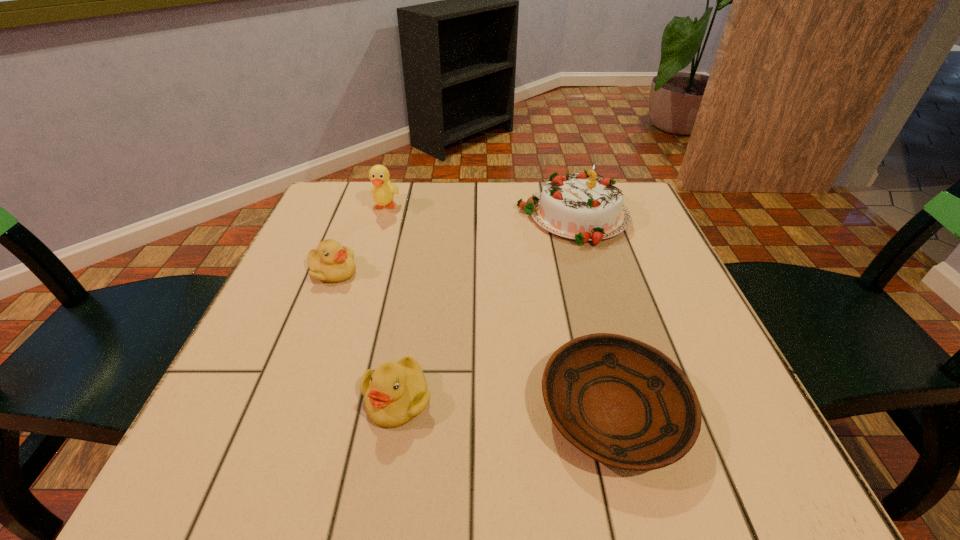
In order to click on cake in this screenshot , I will do [x=582, y=206].

Locate an element on the screen. the tallest duckling is located at coordinates (383, 191).

The image size is (960, 540). What are the coordinates of `the rightmost duckling` in the screenshot? It's located at (396, 392).

Find the location of a particular element. The width and height of the screenshot is (960, 540). the third object from right to left is located at coordinates (396, 392).

The height and width of the screenshot is (540, 960). Find the location of `the third farthest object`. the third farthest object is located at coordinates tap(331, 262).

I want to click on plate, so click(x=620, y=401).

You are a GUI agent. You are given a task and a screenshot of the screen. Output one action in this format:
    pyautogui.click(x=<x>, y=<y>)
    Task: Click on the free space located 0.190m on the left of the cake
    The height and width of the screenshot is (540, 960).
    Given the screenshot: What is the action you would take?
    pyautogui.click(x=441, y=217)

Locate an element on the screen. vacant space located 0.050m on the front-facing side of the tallest duckling is located at coordinates (378, 230).

Identify the location of vacant region located on the front-facing side of the second nearest duckling. The image size is (960, 540). (427, 272).

What are the coordinates of `vacant region located on the left of the shortest object` in the screenshot? It's located at (340, 411).